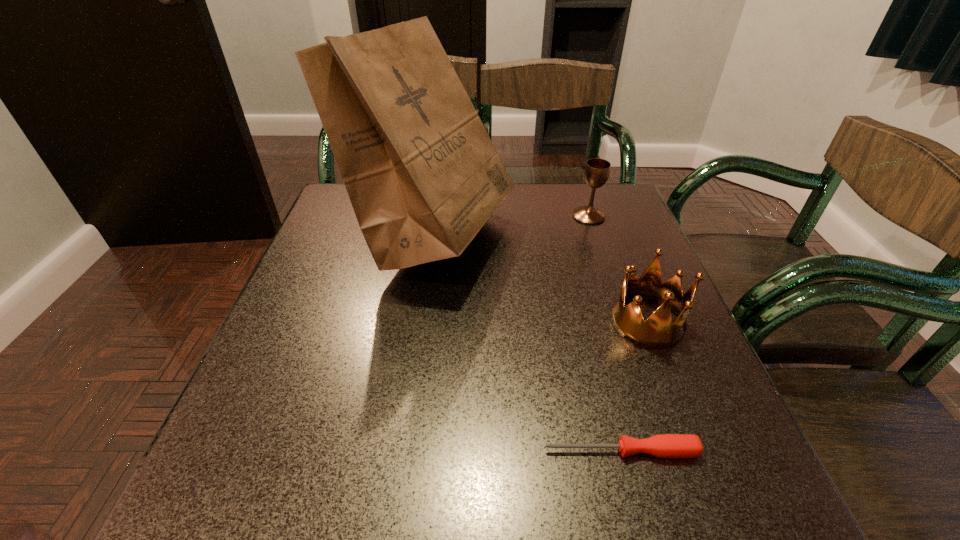
I want to click on vacant space located 0.050m at the tip of the shortest object, so click(513, 451).

Locate an element on the screen. This screenshot has width=960, height=540. vacant space located 0.190m at the tip of the shortest object is located at coordinates (420, 451).

Where is `grocery bag present at the far edge`? grocery bag present at the far edge is located at coordinates (423, 176).

Find the location of `chalice that is at the far edge`. chalice that is at the far edge is located at coordinates (597, 170).

Image resolution: width=960 pixels, height=540 pixels. I want to click on object that is at the near edge, so click(664, 445).

Where is `object that is at the left edge`? object that is at the left edge is located at coordinates (423, 176).

Find the location of `chalice located at the right edge`. chalice located at the right edge is located at coordinates coord(597,170).

Find the location of `crown that is at the right edge`. crown that is at the right edge is located at coordinates (658, 331).

Identify the location of screwdriver located in the right edge section of the desktop. (664, 445).

Locate an element on the screen. This screenshot has height=540, width=960. object present at the far left corner is located at coordinates (423, 176).